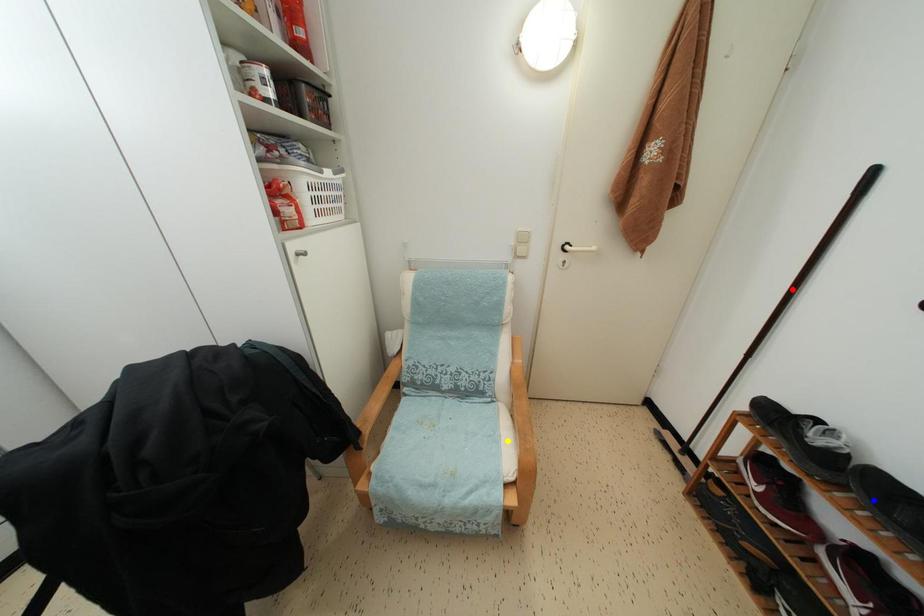
Order these from nearest to farthest:
blue point, yellow point, red point

blue point → yellow point → red point